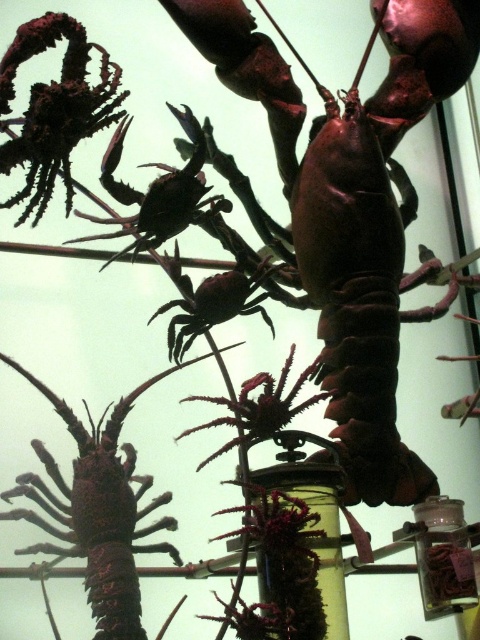
Question: Can you confirm if brown matte lobster at upper center is positioned above shiny brown lobster at center?

Choices:
 (A) yes
 (B) no

Answer: (A)

Question: Which point appears farthest from the camera in this image?

Choices:
 (A) (367, 138)
 (B) (115, 563)

Answer: (A)

Question: Is brown matte lobster at upper center bigger than shiny brown lobster at center?

Choices:
 (A) yes
 (B) no

Answer: (A)

Question: Which object is closer to the camera taking this photo?

Choices:
 (A) shiny brown lobster at center
 (B) brown matte lobster at upper center

Answer: (A)

Question: Does brown matte lobster at upper center appear on the left side of shiny brown lobster at center?

Choices:
 (A) no
 (B) yes

Answer: (A)

Question: Which object appears closest to the camera in this image?

Choices:
 (A) brown matte lobster at upper center
 (B) shiny brown lobster at center

Answer: (B)